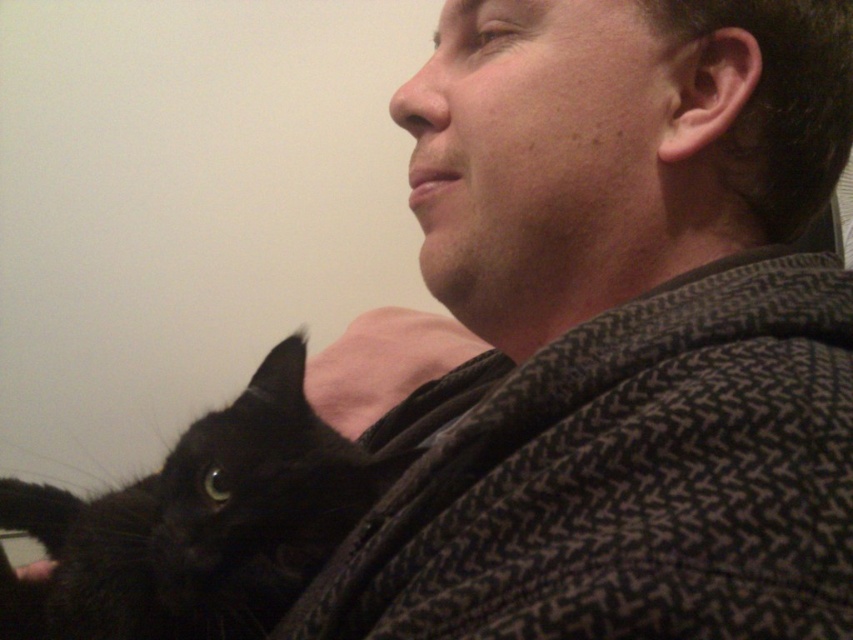
Question: Does textured wool sweater at center come in front of black fur cat at lower left?

Choices:
 (A) no
 (B) yes

Answer: (B)

Question: Can you confirm if textured wool sweater at center is positioned to the left of black fur cat at lower left?

Choices:
 (A) yes
 (B) no

Answer: (B)

Question: Which point is farther to the camera?

Choices:
 (A) textured wool sweater at center
 (B) black fur cat at lower left

Answer: (B)

Question: Is textured wool sweater at center wider than black fur cat at lower left?

Choices:
 (A) no
 (B) yes

Answer: (A)